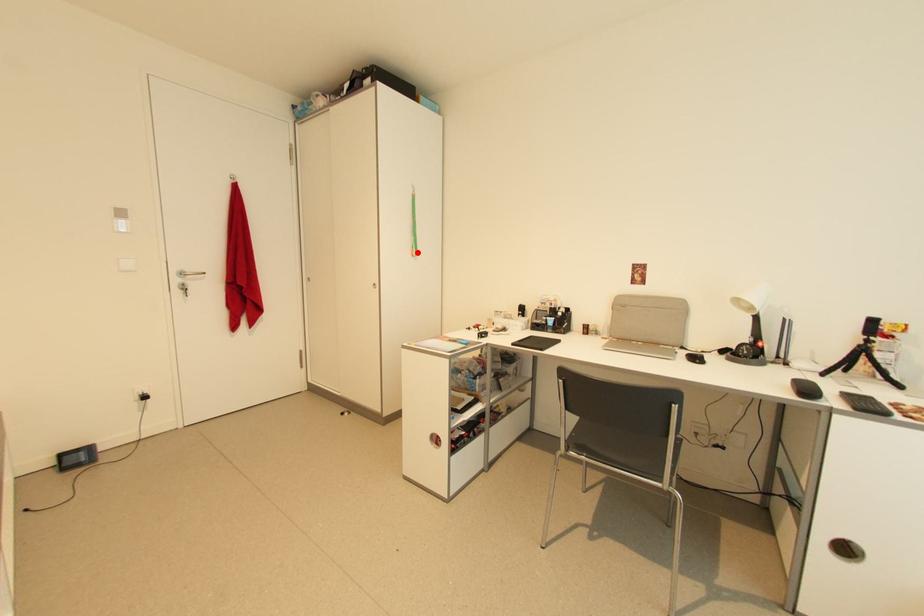
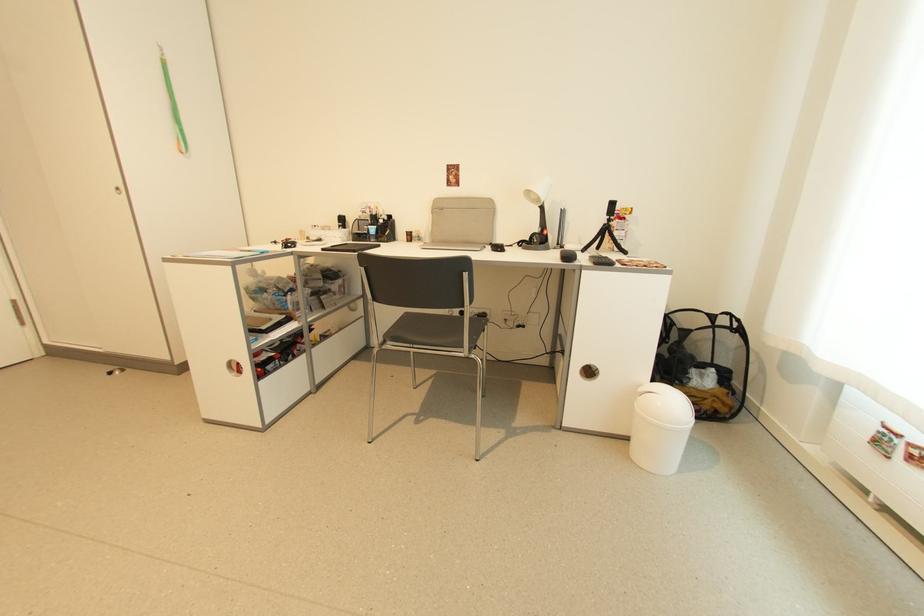
The point at the highlighted location is marked in the first image. Where is the corresponding point in the second image?

(185, 146)